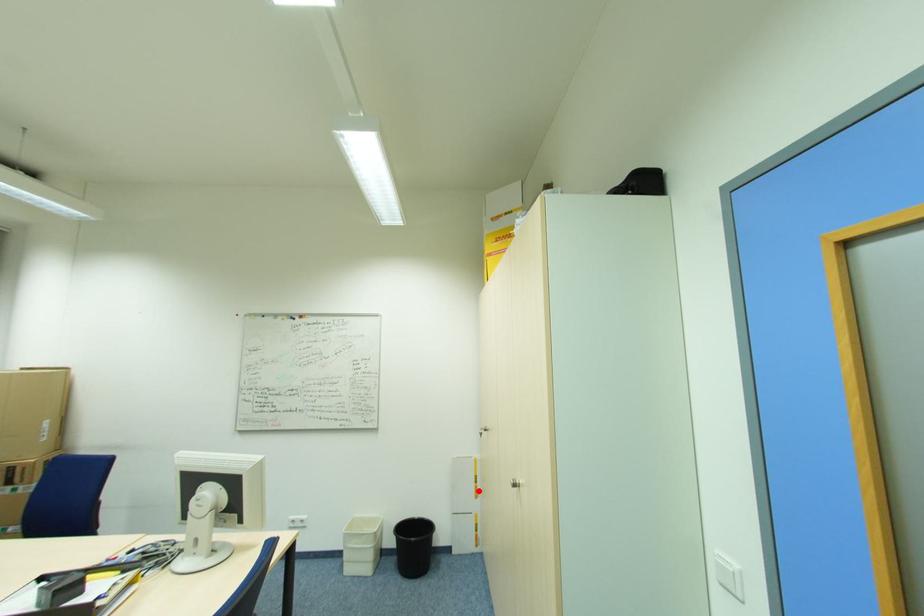
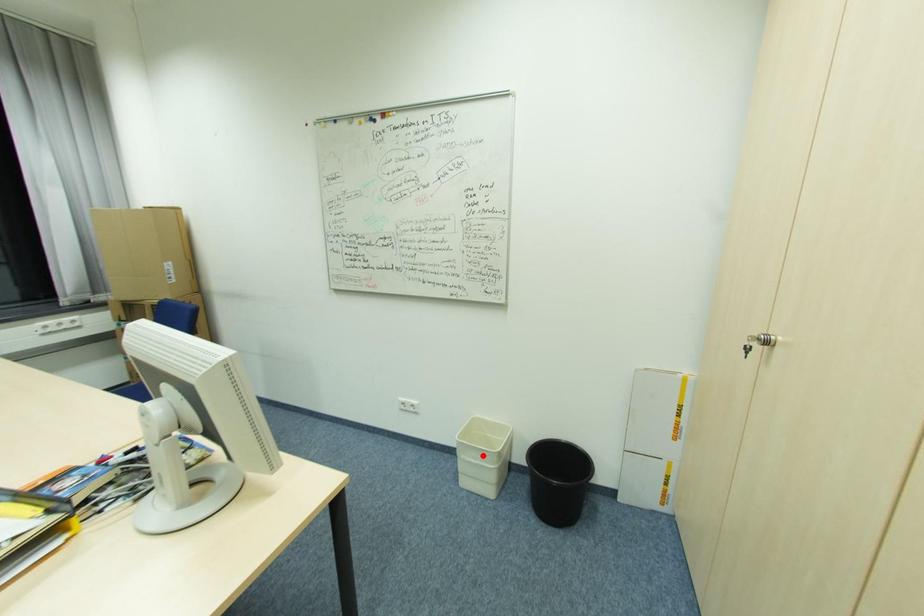
Consider the image. I am providing you with two images of the same scene from different viewpoints. A red point is marked on the first image and another point is marked on the second image. Are the points marked in image1 and image2 representing the same 3D position?

No